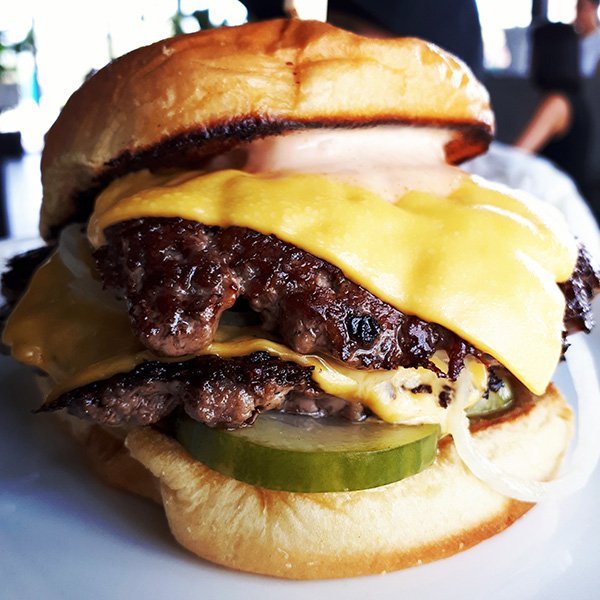
Where is `light`? The width and height of the screenshot is (600, 600). light is located at coordinates (55, 77).